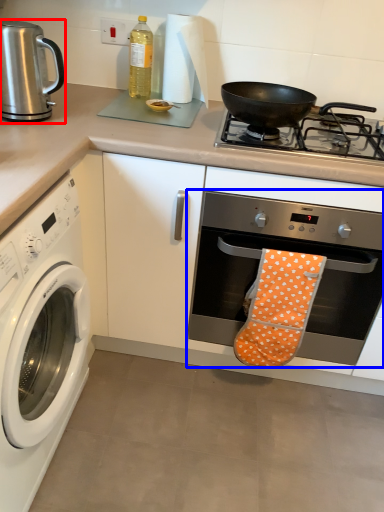
Question: Which object appears farthest to the camera in this image, coffeepot (highlighted by a red box) or oven (highlighted by a blue box)?

Choices:
 (A) coffeepot
 (B) oven

Answer: (B)